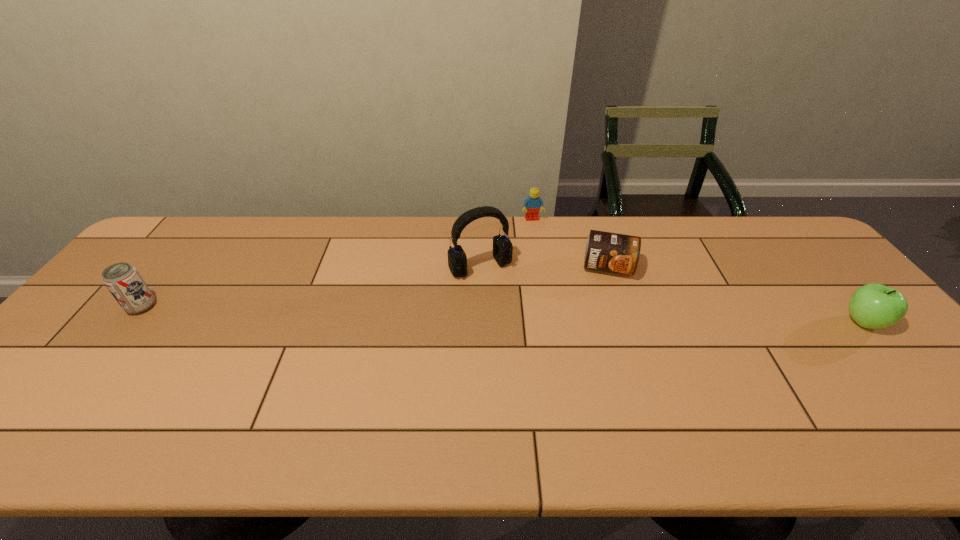
Where is `beer can`? beer can is located at coordinates (124, 282).

Where is `the rightmost object`? The image size is (960, 540). the rightmost object is located at coordinates (874, 306).

Locate an element on the screen. Lego is located at coordinates (532, 204).

Where is `the third object from left to right`? This screenshot has height=540, width=960. the third object from left to right is located at coordinates (532, 204).

Locate an element on the screen. The width and height of the screenshot is (960, 540). the fourth object from right to left is located at coordinates (502, 247).

I want to click on the tallest object, so click(x=502, y=247).

I want to click on the second object from right to left, so click(606, 251).

Identify the location of free space located on the back of the beer can. The image size is (960, 540). (183, 254).

Locate an element on the screen. blank area located on the left of the apple is located at coordinates (762, 322).

Where is `free spot located on the face of the farthest object`? The height and width of the screenshot is (540, 960). free spot located on the face of the farthest object is located at coordinates click(x=545, y=264).